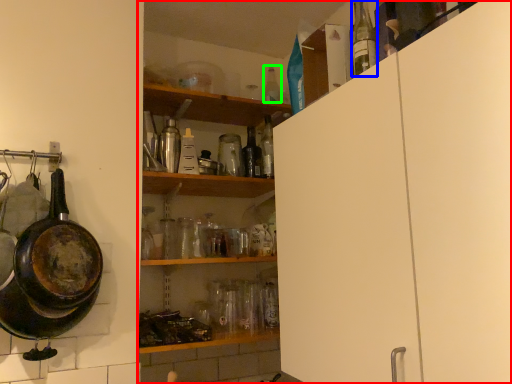
Question: Which object is the closest to the shelf (highlighted by a red box)? Choose among these: bottle (highlighted by a blue box) or bottle (highlighted by a green box).

Choices:
 (A) bottle
 (B) bottle

Answer: (A)